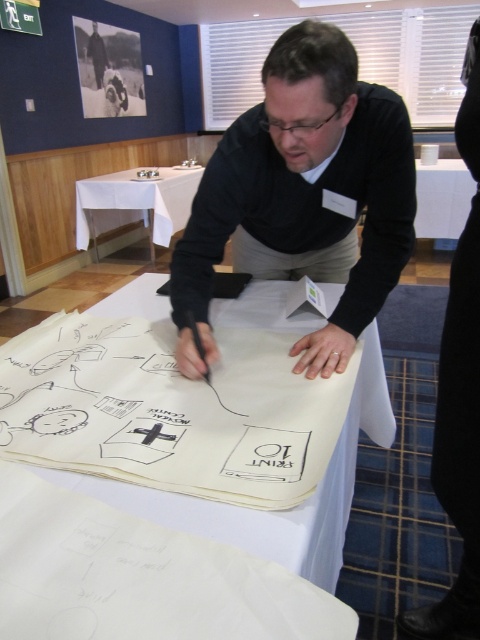
You are organizing a workshop and need to know which item takes up more area on the table. Which one is larger in size between the white paper at center and the white cloth at upper left?

The white cloth at upper left is larger in size than the white paper at center because the white paper at center occupies less space than white cloth at upper left.

You are a photographer trying to capture the man in the scene. The camera you are using has a sensor that can only capture objects within a 0.5 meter radius around the point at coordinates 0.5, 0.5. Will the black matte sweater at center be within the camera sensor range?

The black matte sweater at center is located at point (303,195). The camera sensor covers a 0.5 meter radius around (240,320). Calculating the distance between these points, the distance is sqrt of squared difference in x and y coordinates. The distance is sqrt of 0.194 squared plus 0.133 squared, which is sqrt of 0.0376 plus 0.0177, totaling sqrt of 0.0553, which is approximately 0.235 meters. Since 0.235 meters is less than 0.5 meters, the sweater is within the sensor range.